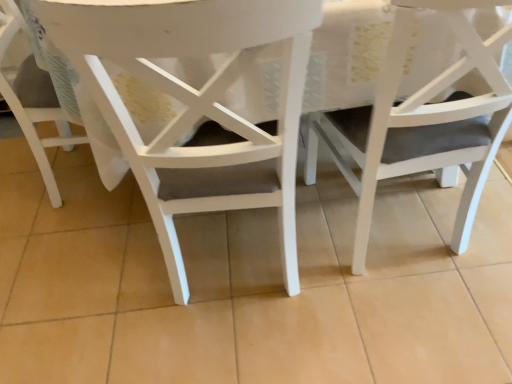
Find the location of `white matte chair at center, the second chair from the right`. white matte chair at center, the second chair from the right is located at coordinates (197, 106).

Looking at this image, between white matte chair at center, which appears as the second chair when viewed from the left, and matte white chair at center, the 3th chair from the left, which one appears on the left side from the viewer's perspective?

Positioned to the left is white matte chair at center, which appears as the second chair when viewed from the left.

Are white matte chair at center, the second chair from the right, and matte white chair at center, which is counted as the 1th chair, starting from the right, making contact?

white matte chair at center, the second chair from the right, and matte white chair at center, which is counted as the 1th chair, starting from the right, are not in contact.

From a real-world perspective, between white matte chair at center, which appears as the second chair when viewed from the left, and matte white chair at center, which is counted as the 1th chair, starting from the right, who is vertically lower?

matte white chair at center, which is counted as the 1th chair, starting from the right.

Is white matte chair at center, which appears as the second chair when viewed from the left, further to the viewer compared to matte white chair at center, which is counted as the 1th chair, starting from the right?

That is False.

Would you say white matte chair at center, which appears as the second chair when viewed from the left, is to the left or to the right of white matte chair at lower left, which is the first chair in left-to-right order, in the picture?

Clearly, white matte chair at center, which appears as the second chair when viewed from the left, is on the right of white matte chair at lower left, which is the first chair in left-to-right order, in the image.

Can you tell me how much white matte chair at center, which appears as the second chair when viewed from the left, and white matte chair at lower left, which is the first chair in left-to-right order, differ in facing direction?

90 degrees separate the facing orientations of white matte chair at center, which appears as the second chair when viewed from the left, and white matte chair at lower left, which is the first chair in left-to-right order.

Does white matte chair at center, the second chair from the right, have a greater height compared to white matte chair at lower left, which is the first chair in left-to-right order?

Yes, white matte chair at center, the second chair from the right, is taller than white matte chair at lower left, which is the first chair in left-to-right order.

Between white matte chair at center, the second chair from the right, and white matte chair at lower left, marked as the third chair in a right-to-left arrangement, which one has smaller width?

white matte chair at center, the second chair from the right, is thinner.

Considering the points (21, 121) and (449, 148), which point is behind, point (21, 121) or point (449, 148)?

The point (21, 121) is behind.

Considering the relative sizes of white matte chair at lower left, which is the first chair in left-to-right order, and matte white chair at center, which is counted as the 1th chair, starting from the right, in the image provided, is white matte chair at lower left, which is the first chair in left-to-right order, thinner than matte white chair at center, which is counted as the 1th chair, starting from the right,?

Indeed, white matte chair at lower left, which is the first chair in left-to-right order, has a lesser width compared to matte white chair at center, which is counted as the 1th chair, starting from the right.

Where is `chair that appears above the matte white chair at center, which is counted as the 1th chair, starting from the right (from the image's perspective)`? This screenshot has width=512, height=384. chair that appears above the matte white chair at center, which is counted as the 1th chair, starting from the right (from the image's perspective) is located at coordinates (31, 94).

Is white matte chair at lower left, which is the first chair in left-to-right order, aimed at matte white chair at center, which is counted as the 1th chair, starting from the right?

Yes, white matte chair at lower left, which is the first chair in left-to-right order, is facing matte white chair at center, which is counted as the 1th chair, starting from the right.

How distant is white matte chair at lower left, marked as the third chair in a right-to-left arrangement, from white matte chair at center, the second chair from the right?

white matte chair at lower left, marked as the third chair in a right-to-left arrangement, is 59.66 centimeters from white matte chair at center, the second chair from the right.

From the picture: From the image's perspective, between white matte chair at lower left, marked as the third chair in a right-to-left arrangement, and white matte chair at center, which appears as the second chair when viewed from the left, who is located below?

white matte chair at center, which appears as the second chair when viewed from the left, is shown below in the image.

In the image, is white matte chair at lower left, which is the first chair in left-to-right order, positioned in front of or behind white matte chair at center, which appears as the second chair when viewed from the left?

Visually, white matte chair at lower left, which is the first chair in left-to-right order, is located behind white matte chair at center, which appears as the second chair when viewed from the left.

Could you tell me if white matte chair at lower left, marked as the third chair in a right-to-left arrangement, is turned towards white matte chair at center, the second chair from the right?

No, white matte chair at lower left, marked as the third chair in a right-to-left arrangement, is not facing towards white matte chair at center, the second chair from the right.

From the image's perspective, is matte white chair at center, the 3th chair from the left, on top of white matte chair at center, which appears as the second chair when viewed from the left?

Indeed, from the image's perspective, matte white chair at center, the 3th chair from the left, is shown above white matte chair at center, which appears as the second chair when viewed from the left.

Does matte white chair at center, which is counted as the 1th chair, starting from the right, lie behind white matte chair at center, the second chair from the right?

That is True.

Is matte white chair at center, the 3th chair from the left, facing towards white matte chair at center, which appears as the second chair when viewed from the left?

No, matte white chair at center, the 3th chair from the left, does not turn towards white matte chair at center, which appears as the second chair when viewed from the left.

Measure the distance between matte white chair at center, which is counted as the 1th chair, starting from the right, and white matte chair at center, which appears as the second chair when viewed from the left.

A distance of 13.48 inches exists between matte white chair at center, which is counted as the 1th chair, starting from the right, and white matte chair at center, which appears as the second chair when viewed from the left.

Is matte white chair at center, which is counted as the 1th chair, starting from the right, further to the viewer compared to white matte chair at lower left, which is the first chair in left-to-right order?

No, matte white chair at center, which is counted as the 1th chair, starting from the right, is closer to the viewer.

Is matte white chair at center, the 3th chair from the left, not inside white matte chair at lower left, which is the first chair in left-to-right order?

Yes, matte white chair at center, the 3th chair from the left, is not within white matte chair at lower left, which is the first chair in left-to-right order.

Is point (330, 112) closer to camera compared to point (45, 168)?

Yes.

Considering the sizes of objects matte white chair at center, which is counted as the 1th chair, starting from the right, and white matte chair at lower left, which is the first chair in left-to-right order, in the image provided, who is wider, matte white chair at center, which is counted as the 1th chair, starting from the right, or white matte chair at lower left, which is the first chair in left-to-right order,?

matte white chair at center, which is counted as the 1th chair, starting from the right.

Locate an element on the screen. This screenshot has height=384, width=512. the 1st chair to the left of the matte white chair at center, the 3th chair from the left, starting your count from the anchor is located at coordinates (197, 106).

There is a white matte chair at lower left, marked as the third chair in a right-to-left arrangement. At what (x,y) coordinates should I click in order to perform the action: click on the 2nd chair above it (from a real-world perspective). Please return your answer as a coordinate pair (x, y). Looking at the image, I should click on (197, 106).

Looking at the image, which one is located further to white matte chair at lower left, which is the first chair in left-to-right order, white matte chair at center, the second chair from the right, or matte white chair at center, the 3th chair from the left?

matte white chair at center, the 3th chair from the left, is further to white matte chair at lower left, which is the first chair in left-to-right order.

From the image, which object appears to be nearer to white matte chair at center, the second chair from the right, matte white chair at center, which is counted as the 1th chair, starting from the right, or white matte chair at lower left, marked as the third chair in a right-to-left arrangement?

Based on the image, matte white chair at center, which is counted as the 1th chair, starting from the right, appears to be nearer to white matte chair at center, the second chair from the right.

When comparing their distances from white matte chair at center, which appears as the second chair when viewed from the left, does white matte chair at lower left, which is the first chair in left-to-right order, or matte white chair at center, the 3th chair from the left, seem further?

white matte chair at lower left, which is the first chair in left-to-right order.

Estimate the real-world distances between objects in this image. Which object is further from white matte chair at lower left, which is the first chair in left-to-right order, matte white chair at center, which is counted as the 1th chair, starting from the right, or white matte chair at center, which appears as the second chair when viewed from the left?

Among the two, matte white chair at center, which is counted as the 1th chair, starting from the right, is located further to white matte chair at lower left, which is the first chair in left-to-right order.

Which object lies nearer to the anchor point matte white chair at center, which is counted as the 1th chair, starting from the right, white matte chair at lower left, marked as the third chair in a right-to-left arrangement, or white matte chair at center, which appears as the second chair when viewed from the left?

Based on the image, white matte chair at center, which appears as the second chair when viewed from the left, appears to be nearer to matte white chair at center, which is counted as the 1th chair, starting from the right.

Based on their spatial positions, is white matte chair at center, the second chair from the right, or white matte chair at lower left, marked as the third chair in a right-to-left arrangement, further from matte white chair at center, the 3th chair from the left?

The object further to matte white chair at center, the 3th chair from the left, is white matte chair at lower left, marked as the third chair in a right-to-left arrangement.

Where is `chair between white matte chair at lower left, marked as the third chair in a right-to-left arrangement, and matte white chair at center, which is counted as the 1th chair, starting from the right, in the horizontal direction`? This screenshot has height=384, width=512. chair between white matte chair at lower left, marked as the third chair in a right-to-left arrangement, and matte white chair at center, which is counted as the 1th chair, starting from the right, in the horizontal direction is located at coordinates (197, 106).